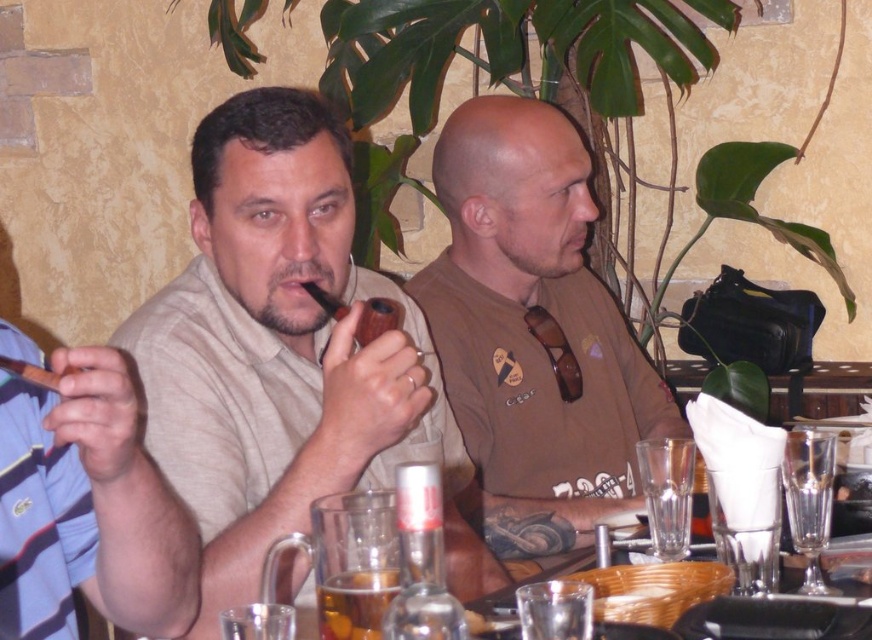
Which is more to the left, brown matte shirt at center or translucent glass mug at lower center?

translucent glass mug at lower center

How much distance is there between brown matte shirt at center and translucent glass mug at lower center?

A distance of 1.03 meters exists between brown matte shirt at center and translucent glass mug at lower center.

Who is more forward, [663,401] or [337,573]?

Point [337,573] is in front.

Where is `brown matte shirt at center`? brown matte shirt at center is located at coordinates (535, 332).

Is matte brown pipe at center further to the viewer compared to brown wooden pipe at left?

That is True.

Between matte brown pipe at center and brown wooden pipe at left, which one is positioned higher?

Positioned higher is matte brown pipe at center.

Locate an element on the screen. The height and width of the screenshot is (640, 872). matte brown pipe at center is located at coordinates (285, 355).

Which is more to the right, matte brown pipe at center or brown matte shirt at center?

brown matte shirt at center

Consider the image. Who is more distant from viewer, [336,477] or [537,385]?

Point [537,385]

Locate an element on the screen. matte brown pipe at center is located at coordinates tap(285, 355).